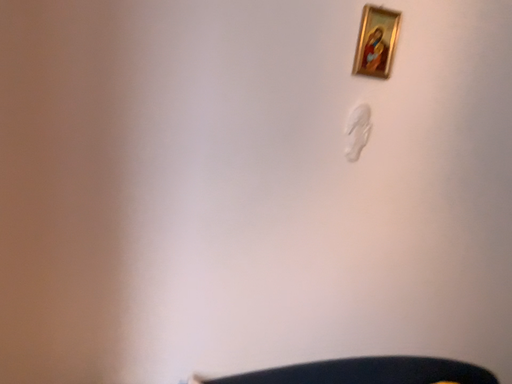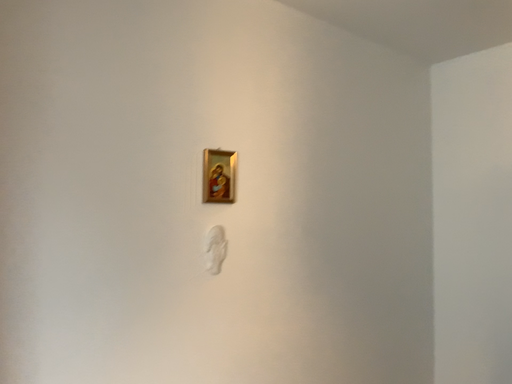
Question: How did the camera likely rotate when shooting the video?

Choices:
 (A) rotated downward
 (B) rotated upward

Answer: (B)